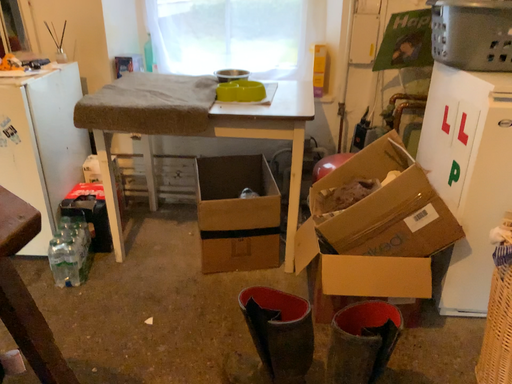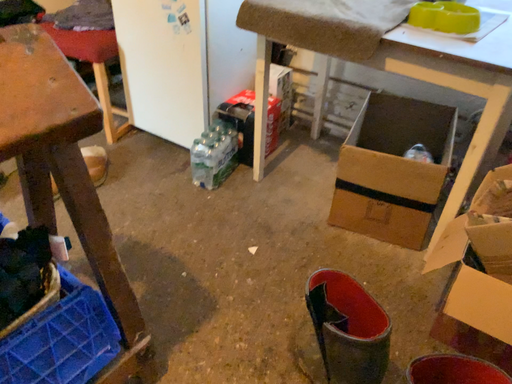
Question: Which way did the camera rotate in the video?

Choices:
 (A) rotated left
 (B) rotated right

Answer: (A)